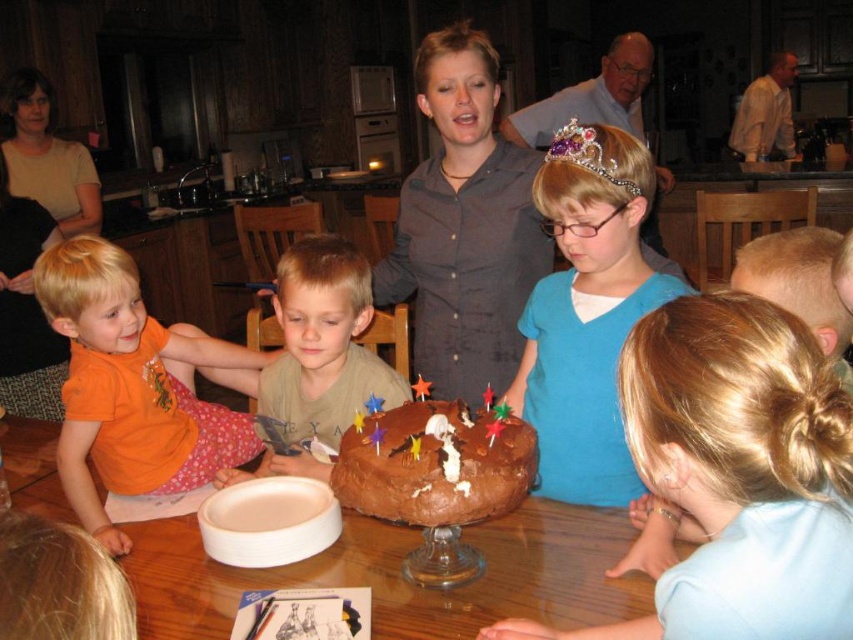
Question: Does brown wooden table at center appear under chocolatesmoothcake at center?

Choices:
 (A) no
 (B) yes

Answer: (B)

Question: Which point appears closest to the camera in this image?

Choices:
 (A) (550, 429)
 (B) (596, 164)
 (C) (486, 580)
 (D) (445, 513)

Answer: (D)

Question: Which object appears closest to the camera in this image?

Choices:
 (A) chocolatesmoothcake at center
 (B) blue matte shirt at center

Answer: (A)

Question: Is brown wooden table at center positioned behind purple gemstone tiara at upper center?

Choices:
 (A) no
 (B) yes

Answer: (A)

Question: Based on their relative distances, which object is farther from the orange cotton shirt at lower left?

Choices:
 (A) brown wooden table at center
 (B) brown matte cake at center
 (C) blue matte shirt at center

Answer: (C)

Question: Is brown wooden table at center smaller than blue matte shirt at center?

Choices:
 (A) no
 (B) yes

Answer: (A)